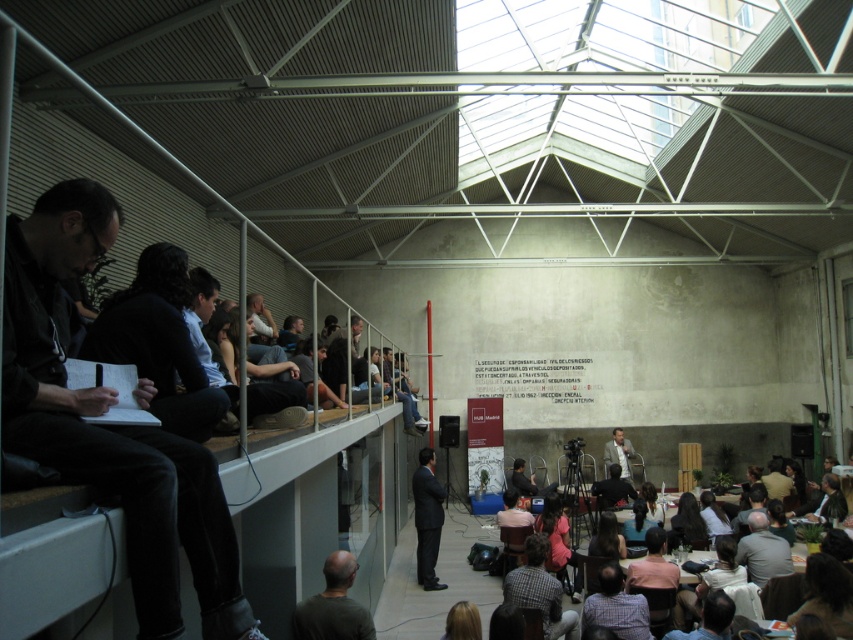
You are standing at the entrance of the venue and want to sit down. There is a dark brown fabric chairs at lower center located at point (838, 602). Can you walk directly to it without passing through any obstacles?

The dark brown fabric chairs at lower center is located at point (838, 602), so yes, you can walk directly to it without any obstacles in your path.

You are a photographer at this event and need to capture a photo of both the dark suit at center and the checkered shirt at lower center. Based on their positions, which one should you focus on first to ensure both are in frame?

The dark suit at center is positioned on the left side of checkered shirt at lower center, so you should focus on the dark suit at center first to ensure both are in frame.

You are a photographer standing at the back of the venue and want to capture a clear photo of the blonde hair at lower center without any obstruction. The dark brown fabric chairs at lower center might block your view. Can you take the photo without moving the chairs?

The dark brown fabric chairs at lower center are taller than the blonde hair at lower center, so they will block the view. You cannot take the photo without moving the chairs.